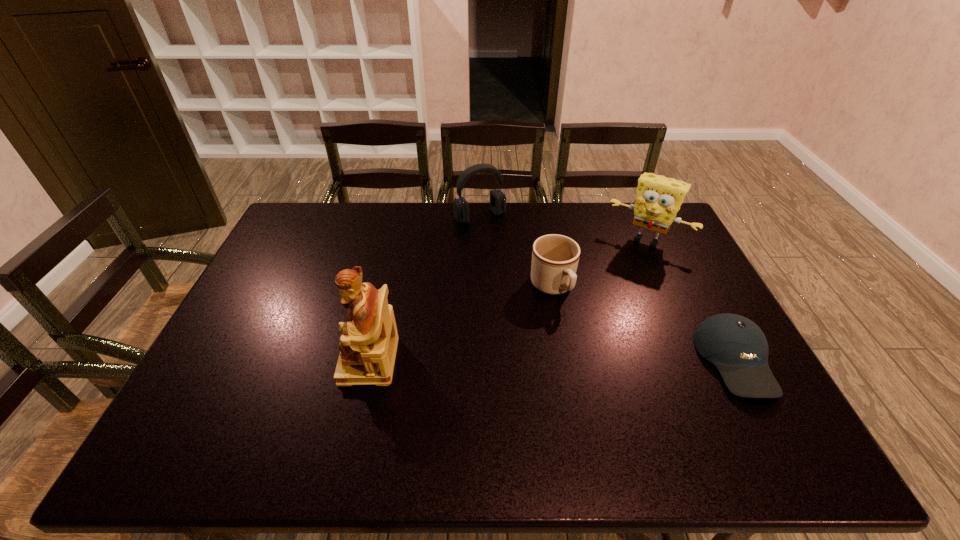
Where is `free space at the right edge`? This screenshot has width=960, height=540. free space at the right edge is located at coordinates (708, 314).

I want to click on free space at the far right corner of the desktop, so click(671, 230).

The width and height of the screenshot is (960, 540). I want to click on vacant space at the near right corner, so click(x=772, y=411).

Locate an element on the screen. vacant area that lies between the third farthest object and the baseball cap is located at coordinates (644, 323).

Locate an element on the screen. This screenshot has width=960, height=540. vacant area that lies between the sponge and the third nearest object is located at coordinates (600, 264).

Locate an element on the screen. Image resolution: width=960 pixels, height=540 pixels. empty space between the sponge and the fourth object from right to left is located at coordinates (564, 228).

This screenshot has width=960, height=540. Identify the location of free space between the headset and the tallest object. (424, 288).

This screenshot has height=540, width=960. Identify the location of vacant point located between the leftmost object and the baseball cap. (552, 360).

In order to click on free spot between the shortest object and the leftmost object in this screenshot , I will do `click(552, 360)`.

The width and height of the screenshot is (960, 540). I want to click on free space between the headset and the mug, so click(x=516, y=252).